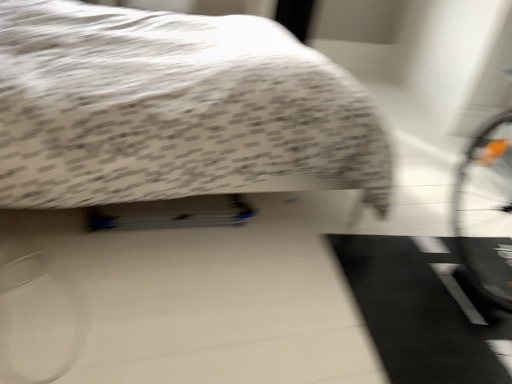
You are a GUI agent. You are given a task and a screenshot of the screen. Output one action in this format:
    pyautogui.click(x=<x>, y=<y>)
    Task: Click on the vacant space behind black rubber doormat at lower right
    
    Given the screenshot: What is the action you would take?
    pyautogui.click(x=411, y=202)